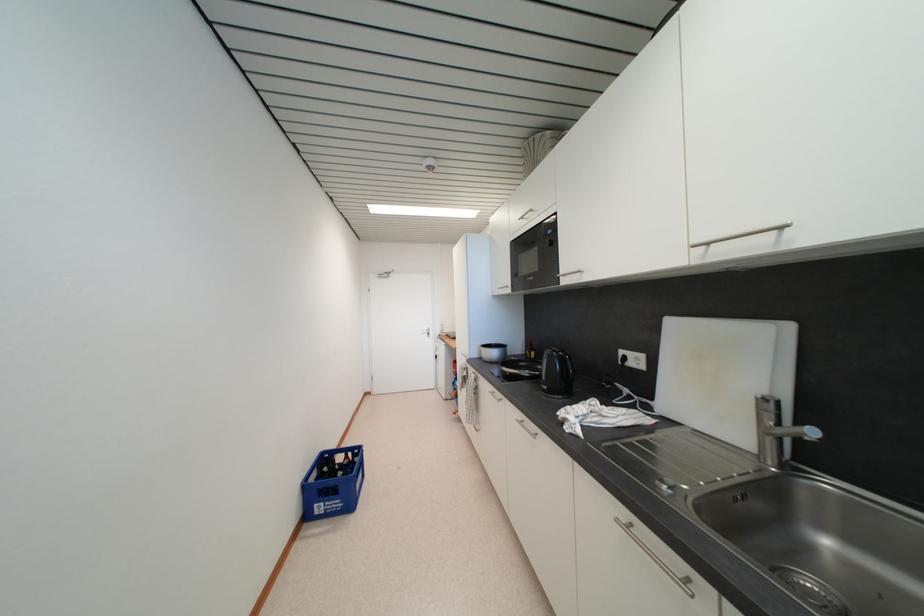
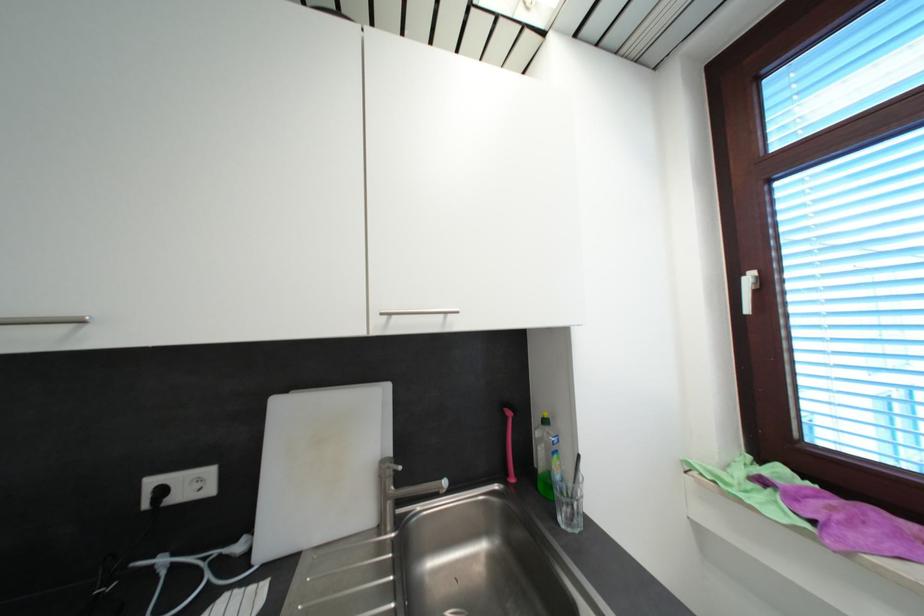
Locate, in the second image, the point that corresponds to pixel 713 246 in the first image.

(395, 315)